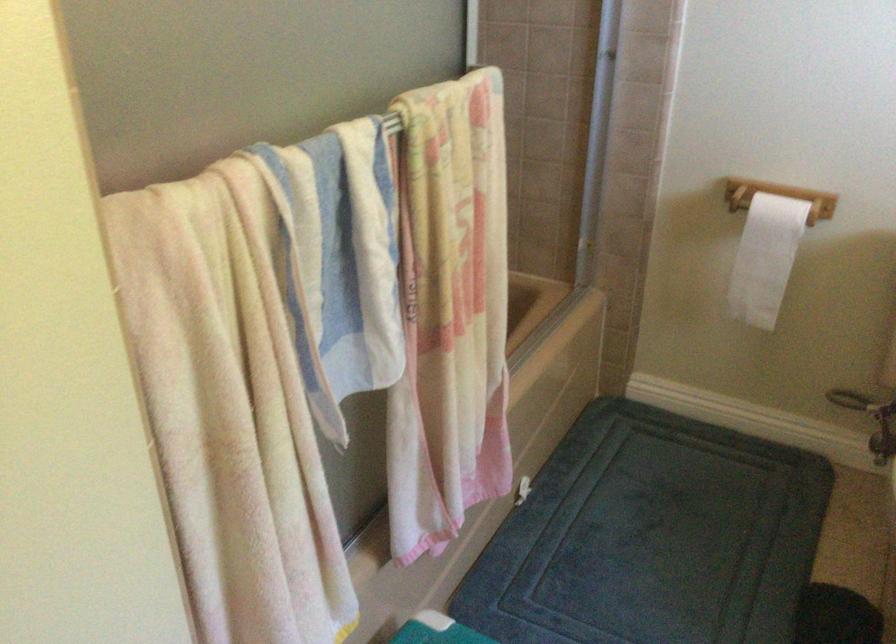
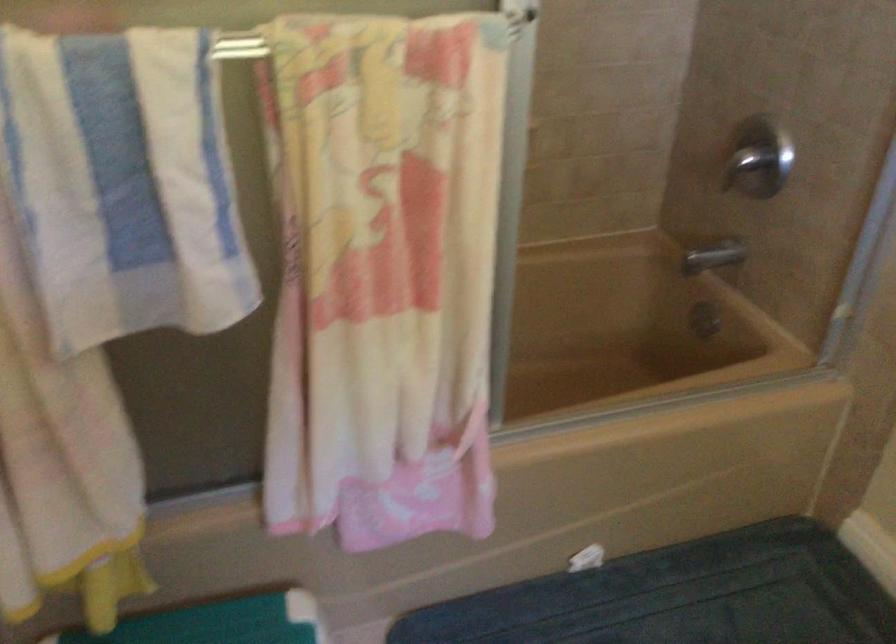
Question: The images are taken continuously from a first-person perspective. In which direction is your viewpoint rotating?

Choices:
 (A) Left
 (B) Right
 (C) Up
 (D) Down

Answer: (A)